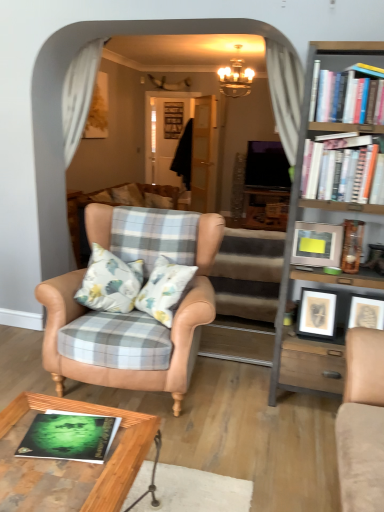
Question: From the image's perspective, would you say woodenwoodentable at lower center is positioned over green matte book at lower left, which ranks as the second book in right-to-left order?

Choices:
 (A) yes
 (B) no

Answer: (B)

Question: Does woodenwoodentable at lower center lie behind green matte book at lower left, which ranks as the second book in right-to-left order?

Choices:
 (A) no
 (B) yes

Answer: (A)

Question: Considering the relative sizes of woodenwoodentable at lower center and green matte book at lower left, which ranks as the second book in right-to-left order, in the image provided, is woodenwoodentable at lower center bigger than green matte book at lower left, which ranks as the second book in right-to-left order,?

Choices:
 (A) yes
 (B) no

Answer: (A)

Question: Does woodenwoodentable at lower center have a lesser width compared to green matte book at lower left, the 2th book when ordered from top to bottom?

Choices:
 (A) no
 (B) yes

Answer: (A)

Question: Is woodenwoodentable at lower center wider than green matte book at lower left, which ranks as the second book in right-to-left order?

Choices:
 (A) no
 (B) yes

Answer: (B)

Question: In the image, is white paperbacks at upper right, which is the 2th book in bottom-to-top order, positioned in front of or behind woodenwoodentable at lower center?

Choices:
 (A) behind
 (B) front

Answer: (A)

Question: From the image's perspective, relative to woodenwoodentable at lower center, is white paperbacks at upper right, which is counted as the first book, starting from the top, above or below?

Choices:
 (A) above
 (B) below

Answer: (A)

Question: Is white paperbacks at upper right, which is the 2th book in bottom-to-top order, inside the boundaries of woodenwoodentable at lower center, or outside?

Choices:
 (A) inside
 (B) outside

Answer: (B)

Question: Considering the positions of white paperbacks at upper right, acting as the 1th book starting from the back, and woodenwoodentable at lower center in the image, is white paperbacks at upper right, acting as the 1th book starting from the back, bigger or smaller than woodenwoodentable at lower center?

Choices:
 (A) small
 (B) big

Answer: (A)

Question: Looking at their shapes, would you say metallic silver picture frame at right, which ranks as the 1th picture frame in top-to-bottom order, is wider or thinner than gold metallic chandelier at upper center?

Choices:
 (A) thin
 (B) wide

Answer: (A)

Question: Considering the positions of metallic silver picture frame at right, placed as the 2th picture frame when sorted from bottom to top, and gold metallic chandelier at upper center in the image, is metallic silver picture frame at right, placed as the 2th picture frame when sorted from bottom to top, taller or shorter than gold metallic chandelier at upper center?

Choices:
 (A) tall
 (B) short

Answer: (B)

Question: Does point (312, 245) appear closer or farther from the camera than point (238, 57)?

Choices:
 (A) closer
 (B) farther

Answer: (A)

Question: From the image's perspective, relative to gold metallic chandelier at upper center, is metallic silver picture frame at right, which ranks as the 1th picture frame in top-to-bottom order, above or below?

Choices:
 (A) above
 (B) below

Answer: (B)

Question: In the image, is leather armchair at center on the left side or the right side of white paperbacks at upper right, which is the 2th book in bottom-to-top order?

Choices:
 (A) left
 (B) right

Answer: (A)

Question: Would you say leather armchair at center is inside or outside white paperbacks at upper right, acting as the first book starting from the right?

Choices:
 (A) inside
 (B) outside

Answer: (B)